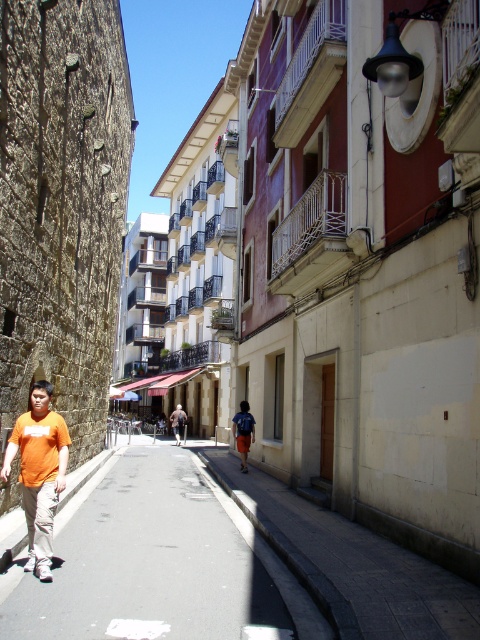
Does smooth concrete sidewalk at center appear under orange cotton shirt at left?

Yes.

Does smooth concrete sidewalk at center appear over orange cotton shirt at left?

Incorrect, smooth concrete sidewalk at center is not positioned above orange cotton shirt at left.

This screenshot has height=640, width=480. What do you see at coordinates (354, 564) in the screenshot?
I see `smooth concrete sidewalk at center` at bounding box center [354, 564].

Image resolution: width=480 pixels, height=640 pixels. I want to click on smooth concrete sidewalk at center, so click(354, 564).

Between smooth asphalt road at center and orange cotton shirt at left, which one appears on the right side from the viewer's perspective?

Positioned to the right is smooth asphalt road at center.

Is point (84, 632) closer to viewer compared to point (23, 442)?

Yes, point (84, 632) is closer to viewer.

Locate an element on the screen. smooth asphalt road at center is located at coordinates (156, 563).

Is smooth asphalt road at center behind smooth concrete sidewalk at center?

That is True.

Can you confirm if smooth asphalt road at center is bigger than smooth concrete sidewalk at center?

Indeed, smooth asphalt road at center has a larger size compared to smooth concrete sidewalk at center.

Which is in front, point (106, 515) or point (384, 545)?

Point (384, 545)

The width and height of the screenshot is (480, 640). I want to click on smooth asphalt road at center, so click(x=156, y=563).